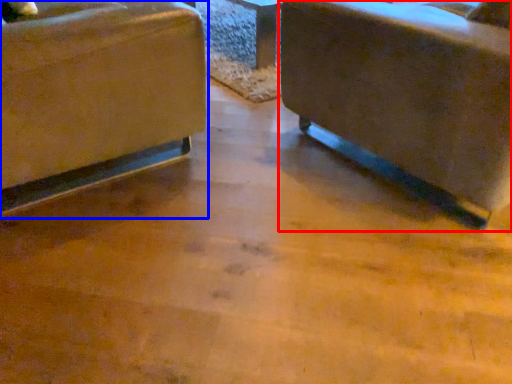
Question: Which object appears farthest to the camera in this image, chair (highlighted by a red box) or chair (highlighted by a blue box)?

Choices:
 (A) chair
 (B) chair

Answer: (B)